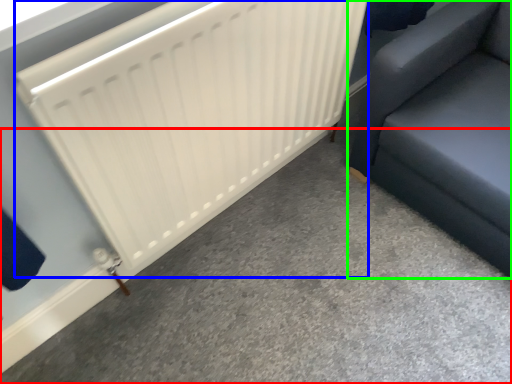
Question: Based on their relative distances, which object is nearer to concrete (highlighted by a red box)? Choose from radiator (highlighted by a blue box) and furniture (highlighted by a green box).

Choices:
 (A) radiator
 (B) furniture

Answer: (B)